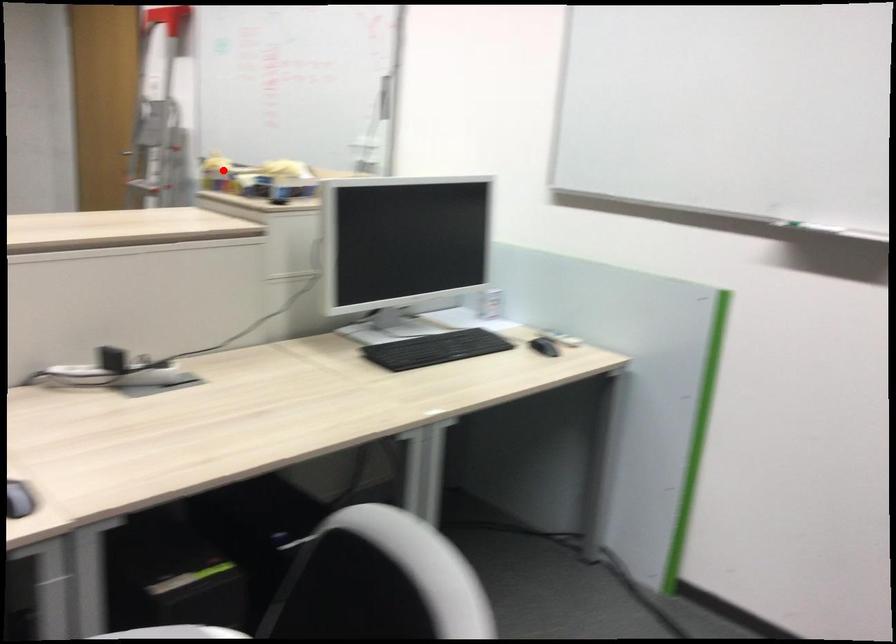
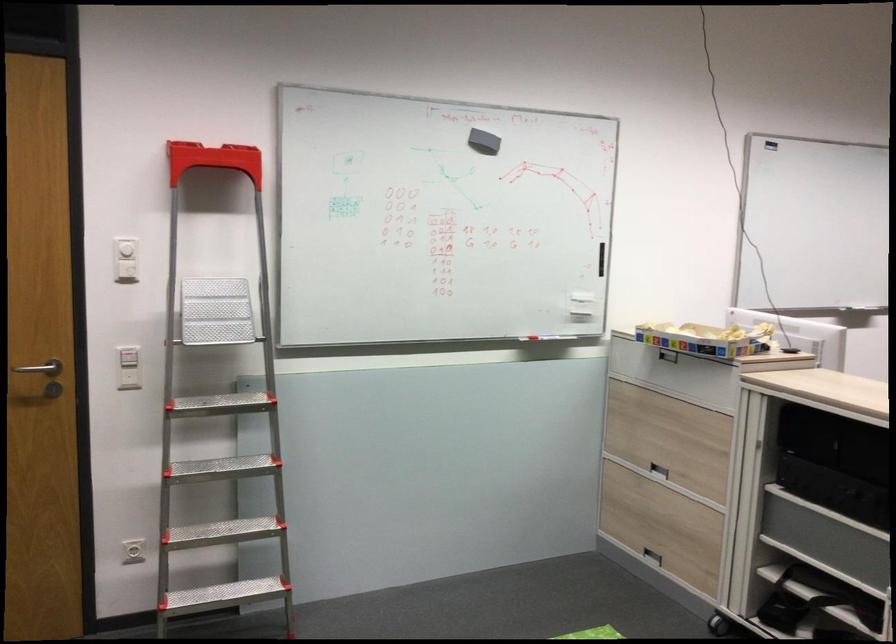
Question: A red point is marked in image1. In image2, is the corresponding 3D point closer to the camera or farther? Reply with the corresponding letter.

Choices:
 (A) The corresponding 3D point is closer.
 (B) The corresponding 3D point is farther.

Answer: (B)